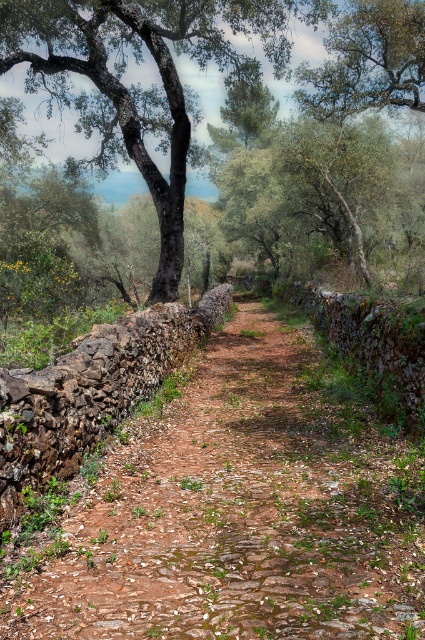
Question: Can you confirm if dark brown bark tree at upper left is bigger than green leafy tree at upper center?

Choices:
 (A) no
 (B) yes

Answer: (B)

Question: Does dark brown bark tree at upper left have a smaller size compared to green leafy tree at upper center?

Choices:
 (A) yes
 (B) no

Answer: (B)

Question: Which of the following is the closest to the observer?

Choices:
 (A) (195, 618)
 (B) (108, 164)
 (C) (359, 1)

Answer: (A)

Question: Does brown stone path at center lie in front of green leafy tree at upper center?

Choices:
 (A) yes
 (B) no

Answer: (A)

Question: Which point is closer to the camera?

Choices:
 (A) (306, 86)
 (B) (84, 52)

Answer: (B)

Question: Which point is farther to the camera?

Choices:
 (A) (314, 77)
 (B) (112, 19)
 (C) (218, 509)

Answer: (A)